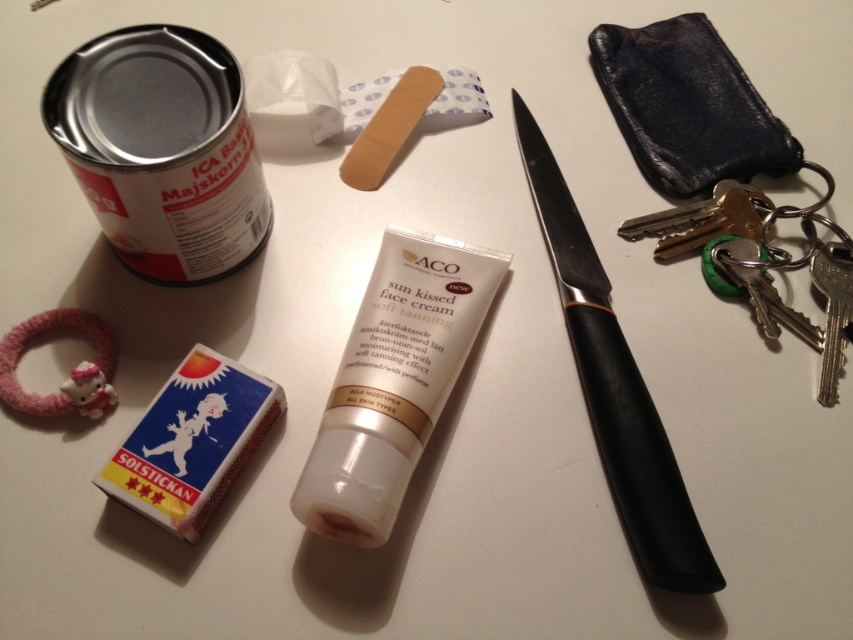
Is white matte tube at center thinner than blue cardboard matchbox at lower left?

In fact, white matte tube at center might be wider than blue cardboard matchbox at lower left.

Does point (469, 253) come farther from viewer compared to point (152, 454)?

Yes, it is behind point (152, 454).

Where is `white matte tube at center`? The image size is (853, 640). white matte tube at center is located at coordinates (393, 381).

Who is positioned more to the right, black plastic knife at upper right or blue cardboard matchbox at lower left?

From the viewer's perspective, black plastic knife at upper right appears more on the right side.

Is black plastic knife at upper right further to camera compared to blue cardboard matchbox at lower left?

No, black plastic knife at upper right is closer to the viewer.

Describe the element at coordinates (614, 388) in the screenshot. I see `black plastic knife at upper right` at that location.

Where is `black plastic knife at upper right`? The height and width of the screenshot is (640, 853). black plastic knife at upper right is located at coordinates (614, 388).

Can you confirm if silver metallic can at upper left is positioned above black plastic knife at upper right?

Yes.

What do you see at coordinates (161, 148) in the screenshot? I see `silver metallic can at upper left` at bounding box center [161, 148].

Identify the location of silver metallic can at upper left. Image resolution: width=853 pixels, height=640 pixels. pos(161,148).